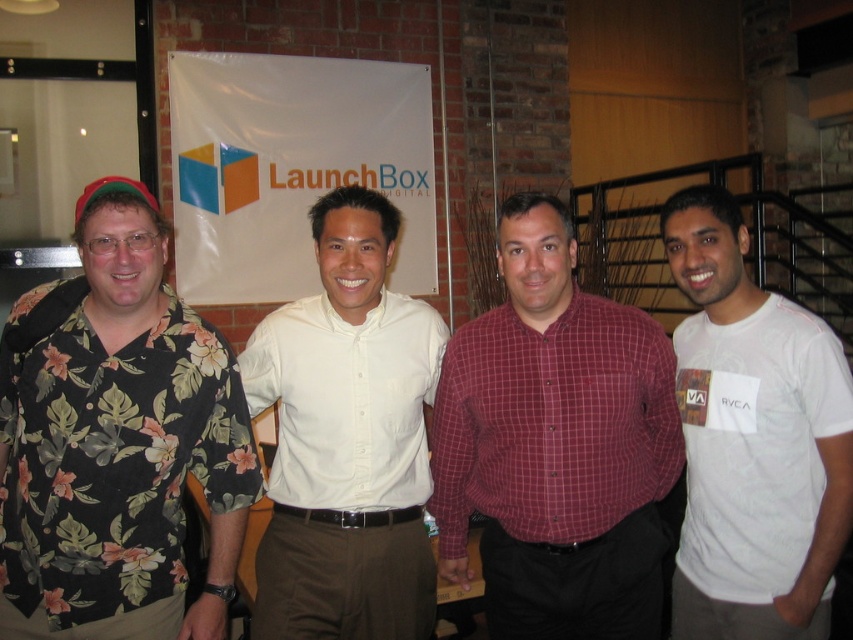
Is point (112, 195) positioned in front of point (315, 349)?

Yes, point (112, 195) is in front of point (315, 349).

Can you confirm if floral print shirt at left is thinner than white smooth shirt at center?

No, floral print shirt at left is not thinner than white smooth shirt at center.

Who is more distant from viewer, (120,376) or (405,541)?

The point (405,541) is more distant.

Where is `floral print shirt at left`? floral print shirt at left is located at coordinates tap(115, 442).

Does floral print shirt at left lie in front of maroon checkered shirt at center?

Yes, it is.

I want to click on floral print shirt at left, so click(x=115, y=442).

Does point (15, 413) lie behind point (549, 545)?

No, it is not.

The width and height of the screenshot is (853, 640). Identify the location of floral print shirt at left. (115, 442).

Between floral print shirt at left and white cotton t-shirt at right, which one has more height?

Standing taller between the two is white cotton t-shirt at right.

Based on the photo, can you confirm if floral print shirt at left is positioned below white cotton t-shirt at right?

No.

Which is behind, point (172, 604) or point (712, 621)?

The point (712, 621) is behind.

Where is `floral print shirt at left`? The width and height of the screenshot is (853, 640). floral print shirt at left is located at coordinates (115, 442).